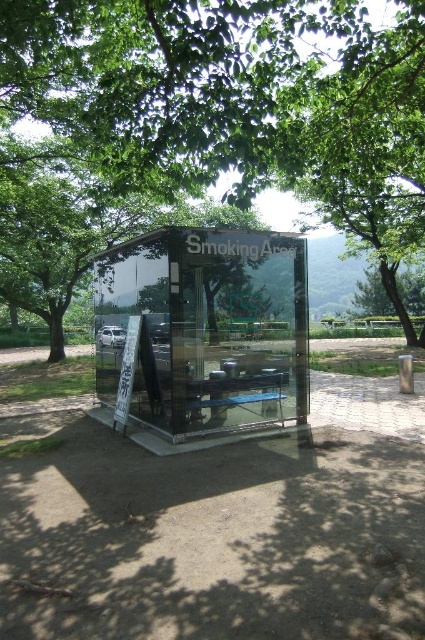
You are a park visitor who wants to take a photo of the transparent glass smoking area at center from the outside. Considering the green leafy tree at center is blocking the view, can you still see the smoking area through the tree?

The green leafy tree at center is larger in size than transparent glass smoking area at center, so the tree may block part of the view, but since the glass is transparent, you can still see the smoking area through the tree.

You are standing outside the transparent glass smoking area at center and want to see the green leafy tree at center. Can you see it through the glass?

The green leafy tree at center is positioned over transparent glass smoking area at center, so yes, you can see it through the glass.

You are standing outside the transparent glass smoking area at center and want to see the green leafy tree at center. Can you see it clearly through the glass?

The transparent glass smoking area at center allows visibility into its interior, so yes, you can see the green leafy tree at center clearly through the glass.